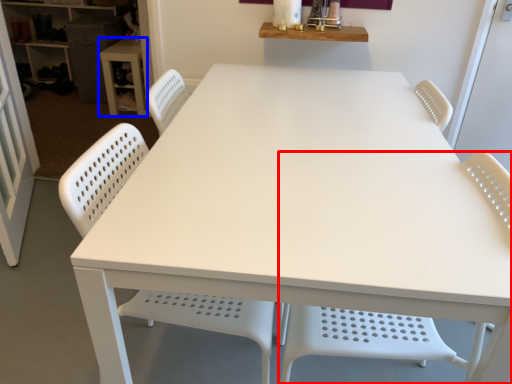
Question: Which point is closer to the camera, chair (highlighted by a red box) or table (highlighted by a blue box)?

Choices:
 (A) chair
 (B) table

Answer: (A)